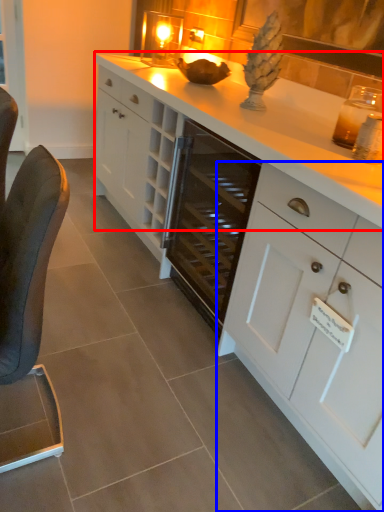
Question: Which object appears farthest to the camera in this image, countertop (highlighted by a red box) or cabinetry (highlighted by a blue box)?

Choices:
 (A) countertop
 (B) cabinetry

Answer: (A)